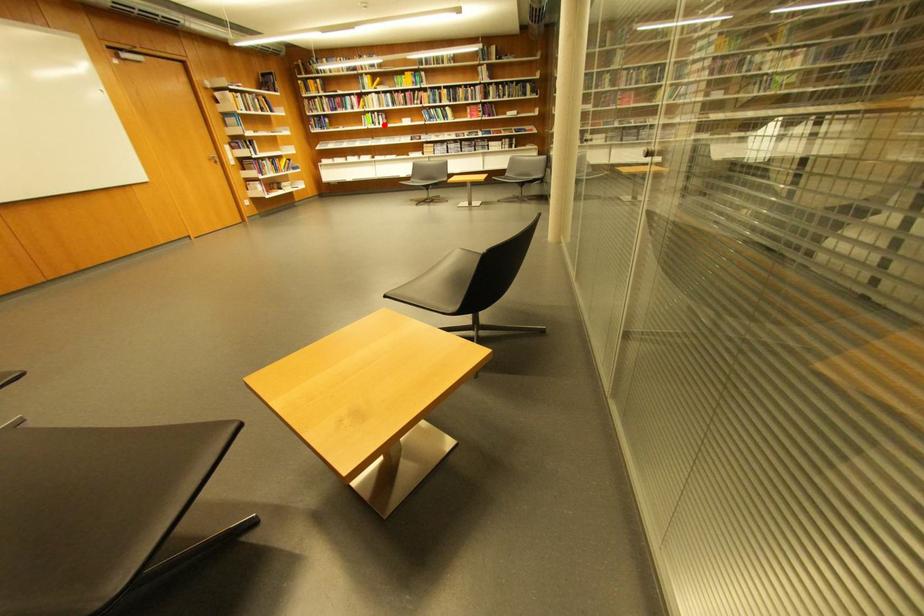
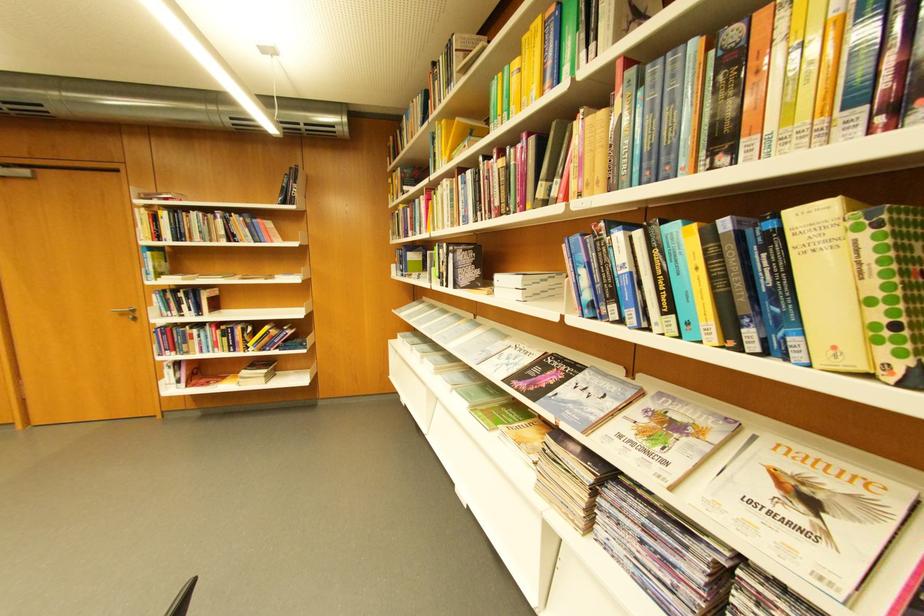
The point at the highlighted location is marked in the first image. Where is the corresponding point in the second image?

(451, 278)